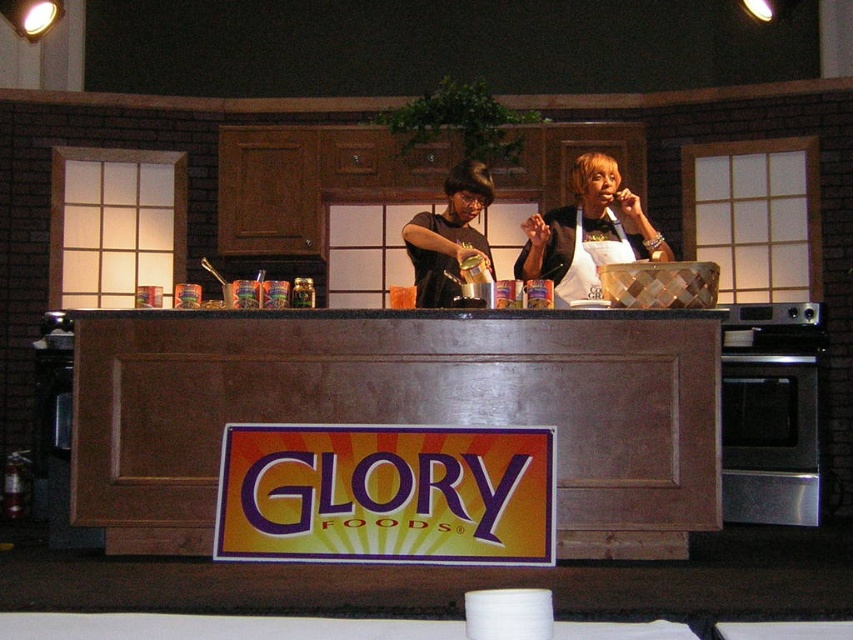
You are a guest at the cooking demonstration and want to place a small plate on the brown wood counter at center without it touching the white fabric apron at center. Is the counter tall enough to allow this?

The brown wood counter at center has a greater height compared to white fabric apron at center, so yes, the counter is tall enough to place the small plate without it touching the apron.

Based on the photo, you are standing in front of the Glory Foods counter and notice two points marked on the setup. Which of the two points, point (633, 257) or point (582, 236), is closer to you?

Point (633, 257) is closer to the viewer than point (582, 236).